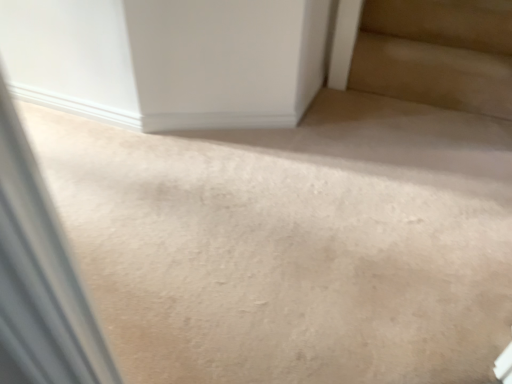
Measure the distance between beige carpet at upper right and camera.

A distance of 1.80 meters exists between beige carpet at upper right and camera.

Locate an element on the screen. This screenshot has height=384, width=512. beige carpet at upper right is located at coordinates (437, 53).

What is the approximate height of beige carpet at upper right?

25.34 centimeters.

What do you see at coordinates (437, 53) in the screenshot? This screenshot has height=384, width=512. I see `beige carpet at upper right` at bounding box center [437, 53].

Where is `beige carpet at upper right`? The width and height of the screenshot is (512, 384). beige carpet at upper right is located at coordinates (x=437, y=53).